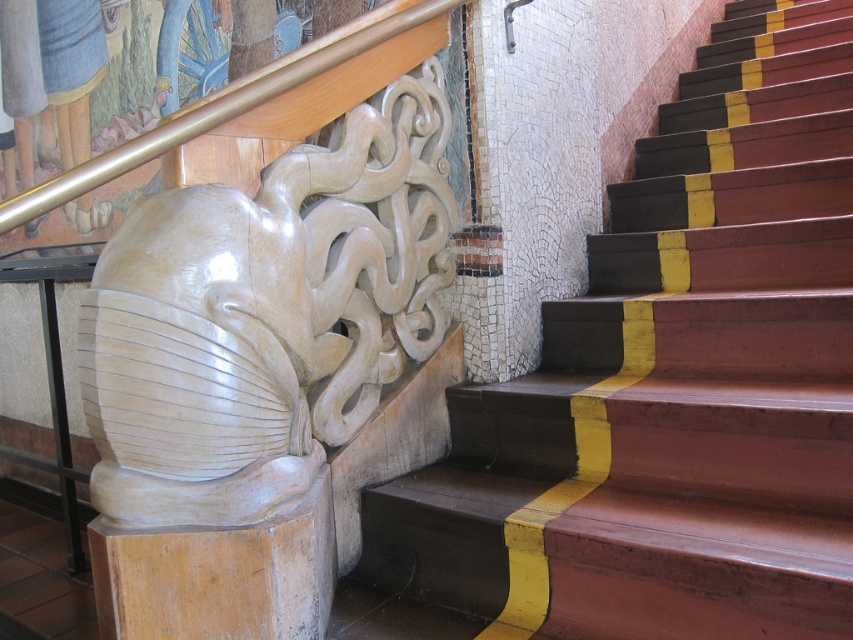
You are a delivery person carrying a package that is 24 inches long. You need to place it between the wooden stairs at center and the matte white sculpture at center. Can the package fit in the space between them without overlapping either object?

The wooden stairs at center and matte white sculpture at center are 22.67 inches apart. Since the package is 24 inches long, which is longer than the space between them, the package cannot fit without overlapping either object.

You are an interior designer assessing the staircase. You need to ensure that the matte white sculpture at center and the gold polished metal handrail at upper left are visible from the bottom of the staircase. Given their heights, which object might block the view of the other when looking upwards?

The matte white sculpture at center has a greater height compared to the gold polished metal handrail at upper left. Therefore, the matte white sculpture at center might block the view of the gold polished metal handrail at upper left when looking upwards.

You are a painter standing at the bottom of the wooden stairs at center. You need to paint the gold polished metal handrail at upper left. Can you reach it without climbing the stairs?

The wooden stairs at center is taller than gold polished metal handrail at upper left, so you can reach the gold polished metal handrail at upper left without climbing the stairs because it is shorter than the stairs.